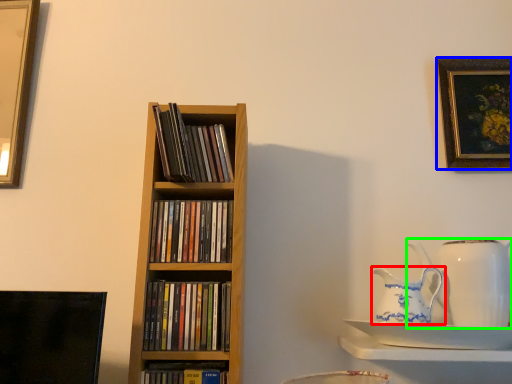
Question: Which object is the farthest from jug (highlighted by a red box)? Choose among these: picture frame (highlighted by a blue box) or jug (highlighted by a green box).

Choices:
 (A) picture frame
 (B) jug

Answer: (A)